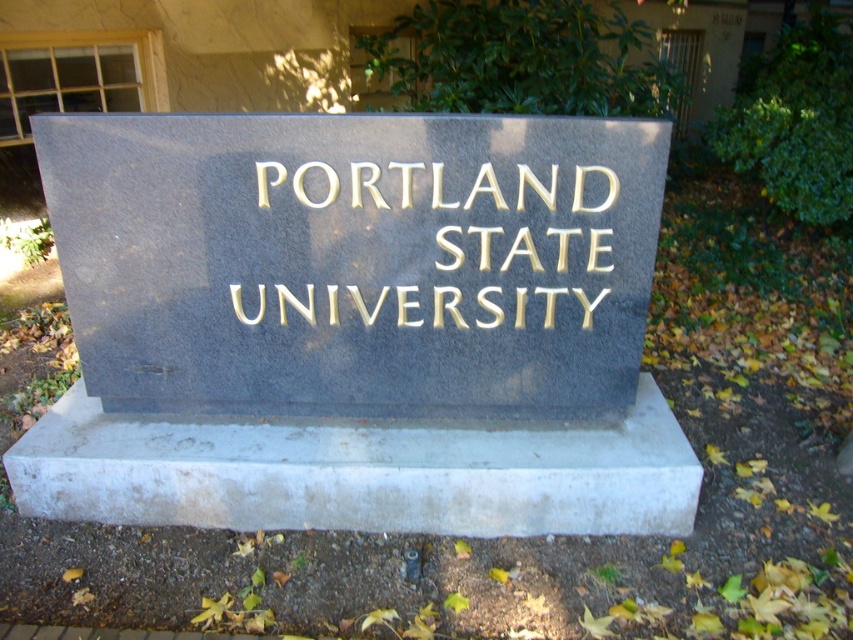
You are standing in front of the black granite sign at center and want to touch the gold embossed text at center. Can you reach it without moving your position?

The black granite sign at center is closer to the viewer than the gold embossed text at center, so you cannot reach the gold embossed text at center without moving closer.

You are a photographer planning to take a picture of the black granite sign at center and the gold embossed text at center. Considering their sizes, which object should you focus on to ensure both are clearly visible in the frame?

The black granite sign at center is much taller than the gold embossed text at center, so focusing on the black granite sign at center will ensure both are clearly visible in the frame since it is larger and occupies more space.